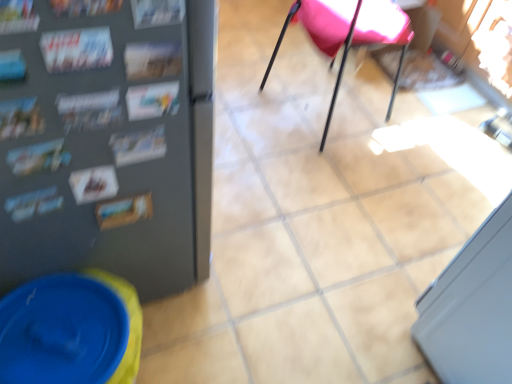
Describe the element at coordinates (348, 33) in the screenshot. I see `pink fabric chair at center` at that location.

Looking at this image, what is the approximate width of printed paper magazine at left, placed as the first magazine when sorted from left to right?

1.25 centimeters.

I want to click on printed paper magazine at upper left, which ranks as the second magazine in right-to-left order, so click(x=152, y=59).

This screenshot has height=384, width=512. I want to click on pink fabric chair at center, so click(x=348, y=33).

From the picture: Is matte paper magazine at upper left, the 1th magazine viewed from the right, in front of or behind pink fabric chair at center in the image?

matte paper magazine at upper left, the 1th magazine viewed from the right, is positioned closer to the viewer than pink fabric chair at center.

From the image's perspective, which one is positioned higher, matte paper magazine at upper left, the 1th magazine viewed from the right, or pink fabric chair at center?

pink fabric chair at center appears higher in the image.

Between point (149, 2) and point (264, 75), which one is positioned behind?

The point (264, 75) is behind.

Does matte paper magazine at upper left, the 1th magazine viewed from the right, have a greater height compared to pink fabric chair at center?

No, matte paper magazine at upper left, the 1th magazine viewed from the right, is not taller than pink fabric chair at center.

From the pink fabric chair at center, count the 2nd magazine to the left and point to it. Please provide its 2D coordinates.

[(152, 59)]

How many degrees apart are the facing directions of pink fabric chair at center and printed paper magazine at upper left, arranged as the second magazine when viewed from the left?

They differ by 105 degrees in their facing directions.

Between point (361, 17) and point (162, 61), which one is positioned in front?

The point (162, 61) is in front.

Considering the sizes of objects pink fabric chair at center and printed paper magazine at upper left, arranged as the second magazine when viewed from the left, in the image provided, who is shorter, pink fabric chair at center or printed paper magazine at upper left, arranged as the second magazine when viewed from the left,?

With less height is printed paper magazine at upper left, arranged as the second magazine when viewed from the left.

Is there a large distance between matte paper magazine at upper left, which is counted as the 3th magazine, starting from the left, and printed paper magazine at left, placed as the first magazine when sorted from left to right?

That's not correct — matte paper magazine at upper left, which is counted as the 3th magazine, starting from the left, is a little close to printed paper magazine at left, placed as the first magazine when sorted from left to right.

From a real-world perspective, is matte paper magazine at upper left, which is counted as the 3th magazine, starting from the left, on top of printed paper magazine at left, placed as the first magazine when sorted from left to right?

Indeed, from a real-world perspective, matte paper magazine at upper left, which is counted as the 3th magazine, starting from the left, stands above printed paper magazine at left, placed as the first magazine when sorted from left to right.

Considering their positions, is matte paper magazine at upper left, the 1th magazine viewed from the right, located in front of or behind printed paper magazine at left, placed as the first magazine when sorted from left to right?

Visually, matte paper magazine at upper left, the 1th magazine viewed from the right, is located in front of printed paper magazine at left, placed as the first magazine when sorted from left to right.

Could printed paper magazine at left, placed as the first magazine when sorted from left to right, be considered to be inside matte paper magazine at upper left, which is counted as the 3th magazine, starting from the left?

No, matte paper magazine at upper left, which is counted as the 3th magazine, starting from the left, does not contain printed paper magazine at left, placed as the first magazine when sorted from left to right.

Is printed paper magazine at upper left, which ranks as the second magazine in right-to-left order, situated inside matte paper magazine at upper left, which is counted as the 3th magazine, starting from the left, or outside?

printed paper magazine at upper left, which ranks as the second magazine in right-to-left order, is not inside matte paper magazine at upper left, which is counted as the 3th magazine, starting from the left, it's outside.

Is matte paper magazine at upper left, the 1th magazine viewed from the right, at the back of printed paper magazine at upper left, which ranks as the second magazine in right-to-left order?

No, printed paper magazine at upper left, which ranks as the second magazine in right-to-left order, is not facing the opposite direction of matte paper magazine at upper left, the 1th magazine viewed from the right.

At what (x,y) coordinates should I click in order to perform the action: click on magazine on the right of printed paper magazine at upper left, arranged as the second magazine when viewed from the left. Please return your answer as a coordinate pair (x, y). Image resolution: width=512 pixels, height=384 pixels. Looking at the image, I should click on (157, 12).

From a real-world perspective, is pink fabric chair at center physically below matte paper magazine at upper left, which is counted as the 3th magazine, starting from the left?

Yes, from a real-world perspective, pink fabric chair at center is under matte paper magazine at upper left, which is counted as the 3th magazine, starting from the left.

From the picture: Is pink fabric chair at center facing away from matte paper magazine at upper left, which is counted as the 3th magazine, starting from the left?

Yes, matte paper magazine at upper left, which is counted as the 3th magazine, starting from the left, is at the back of pink fabric chair at center.

Which is more to the left, pink fabric chair at center or matte paper magazine at upper left, which is counted as the 3th magazine, starting from the left?

matte paper magazine at upper left, which is counted as the 3th magazine, starting from the left, is more to the left.

Is pink fabric chair at center further to the viewer compared to matte paper magazine at upper left, which is counted as the 3th magazine, starting from the left?

Yes, pink fabric chair at center is further from the viewer.

Does point (164, 13) come farther from viewer compared to point (145, 61)?

That is False.

In the scene shown: Does matte paper magazine at upper left, which is counted as the 3th magazine, starting from the left, appear on the left side of printed paper magazine at upper left, arranged as the second magazine when viewed from the left?

In fact, matte paper magazine at upper left, which is counted as the 3th magazine, starting from the left, is to the right of printed paper magazine at upper left, arranged as the second magazine when viewed from the left.

Is there a large distance between matte paper magazine at upper left, which is counted as the 3th magazine, starting from the left, and printed paper magazine at upper left, which ranks as the second magazine in right-to-left order?

That's not correct — matte paper magazine at upper left, which is counted as the 3th magazine, starting from the left, is a little close to printed paper magazine at upper left, which ranks as the second magazine in right-to-left order.

Is matte paper magazine at upper left, the 1th magazine viewed from the right, situated inside printed paper magazine at upper left, arranged as the second magazine when viewed from the left, or outside?

matte paper magazine at upper left, the 1th magazine viewed from the right, is spatially situated outside printed paper magazine at upper left, arranged as the second magazine when viewed from the left.

Which of these two, pink fabric chair at center or printed paper magazine at left, which ranks as the 3th magazine in right-to-left order, stands shorter?

With less height is printed paper magazine at left, which ranks as the 3th magazine in right-to-left order.

Is pink fabric chair at center aimed at printed paper magazine at left, which ranks as the 3th magazine in right-to-left order?

No, pink fabric chair at center is not aimed at printed paper magazine at left, which ranks as the 3th magazine in right-to-left order.

From the picture: Is pink fabric chair at center not near printed paper magazine at left, which ranks as the 3th magazine in right-to-left order?

pink fabric chair at center is positioned a significant distance from printed paper magazine at left, which ranks as the 3th magazine in right-to-left order.

Which of these two, pink fabric chair at center or printed paper magazine at left, placed as the first magazine when sorted from left to right, is wider?

With larger width is pink fabric chair at center.

There is a pink fabric chair at center. Identify the location of the 1st magazine below it (from the image's perspective). (157, 12).

Find the location of a particular element. chair above the printed paper magazine at upper left, which ranks as the second magazine in right-to-left order (from the image's perspective) is located at coordinates (348, 33).

Which object lies nearer to the anchor point printed paper magazine at upper left, arranged as the second magazine when viewed from the left, matte paper magazine at upper left, which is counted as the 3th magazine, starting from the left, or printed paper magazine at left, which ranks as the 3th magazine in right-to-left order?

Based on the image, matte paper magazine at upper left, which is counted as the 3th magazine, starting from the left, appears to be nearer to printed paper magazine at upper left, arranged as the second magazine when viewed from the left.

Estimate the real-world distances between objects in this image. Which object is closer to printed paper magazine at upper left, which ranks as the second magazine in right-to-left order, printed paper magazine at left, placed as the first magazine when sorted from left to right, or matte paper magazine at upper left, which is counted as the 3th magazine, starting from the left?

The object closer to printed paper magazine at upper left, which ranks as the second magazine in right-to-left order, is matte paper magazine at upper left, which is counted as the 3th magazine, starting from the left.

When comparing their distances from printed paper magazine at upper left, arranged as the second magazine when viewed from the left, does printed paper magazine at left, placed as the first magazine when sorted from left to right, or pink fabric chair at center seem closer?

printed paper magazine at left, placed as the first magazine when sorted from left to right, is positioned closer to the anchor printed paper magazine at upper left, arranged as the second magazine when viewed from the left.

Which object lies further to the anchor point matte paper magazine at upper left, which is counted as the 3th magazine, starting from the left, pink fabric chair at center or printed paper magazine at upper left, arranged as the second magazine when viewed from the left?

Among the two, pink fabric chair at center is located further to matte paper magazine at upper left, which is counted as the 3th magazine, starting from the left.

Considering their positions, is matte paper magazine at upper left, the 1th magazine viewed from the right, positioned closer to printed paper magazine at left, placed as the first magazine when sorted from left to right, than printed paper magazine at upper left, which ranks as the second magazine in right-to-left order?

Based on the image, printed paper magazine at upper left, which ranks as the second magazine in right-to-left order, appears to be nearer to printed paper magazine at left, placed as the first magazine when sorted from left to right.

Considering their positions, is printed paper magazine at left, placed as the first magazine when sorted from left to right, positioned closer to matte paper magazine at upper left, which is counted as the 3th magazine, starting from the left, than printed paper magazine at upper left, arranged as the second magazine when viewed from the left?

Among the two, printed paper magazine at upper left, arranged as the second magazine when viewed from the left, is located nearer to matte paper magazine at upper left, which is counted as the 3th magazine, starting from the left.

Which object lies further to the anchor point pink fabric chair at center, matte paper magazine at upper left, the 1th magazine viewed from the right, or printed paper magazine at left, placed as the first magazine when sorted from left to right?

Based on the image, printed paper magazine at left, placed as the first magazine when sorted from left to right, appears to be further to pink fabric chair at center.

From the image, which object appears to be farther from matte paper magazine at upper left, the 1th magazine viewed from the right, printed paper magazine at upper left, which ranks as the second magazine in right-to-left order, or printed paper magazine at left, placed as the first magazine when sorted from left to right?

printed paper magazine at left, placed as the first magazine when sorted from left to right, lies further to matte paper magazine at upper left, the 1th magazine viewed from the right, than the other object.

The image size is (512, 384). In order to click on magazine located between printed paper magazine at left, placed as the first magazine when sorted from left to right, and matte paper magazine at upper left, the 1th magazine viewed from the right, in the left-right direction in this screenshot , I will do coord(152,59).

The height and width of the screenshot is (384, 512). I want to click on magazine between printed paper magazine at left, placed as the first magazine when sorted from left to right, and pink fabric chair at center from front to back, so click(x=152, y=59).